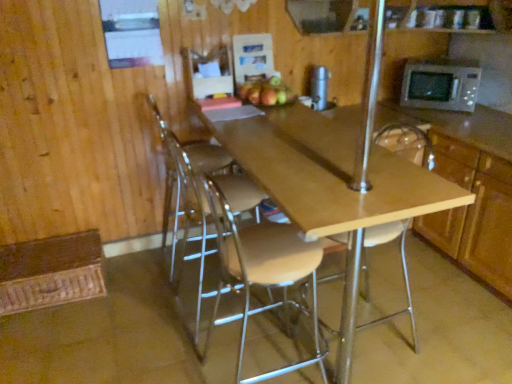
Locate an element on the screen. The image size is (512, 384). vacant area situated to the left side of light wood/matte table at center is located at coordinates (125, 324).